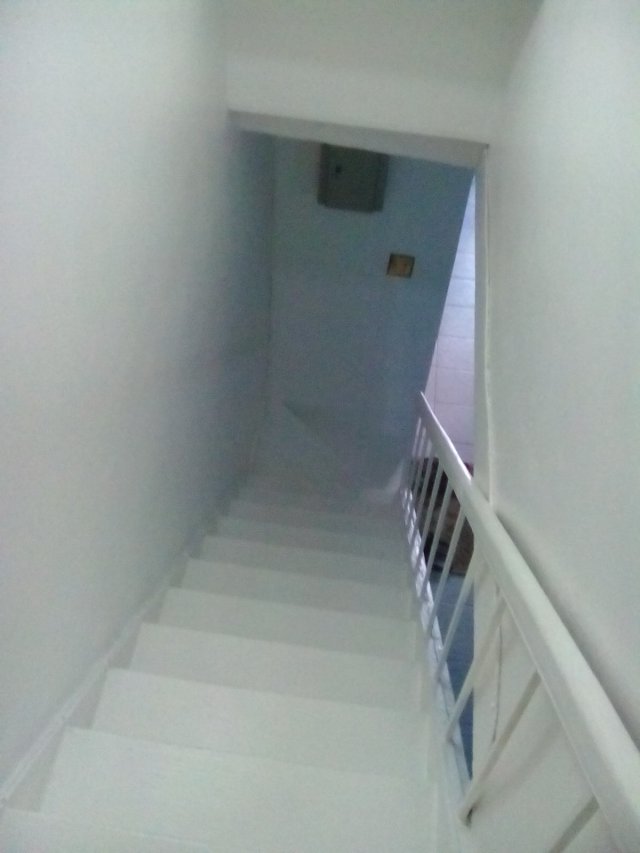
At what (x,y) coordinates should I click in order to perform the action: click on end wall at the bottom of the flight of stairs. Please return your answer as a coordinate pair (x, y). The width and height of the screenshot is (640, 853). Looking at the image, I should click on (346, 322).